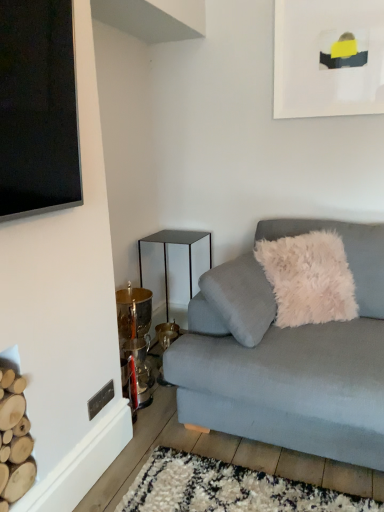
Describe the element at coordinates (166, 251) in the screenshot. I see `metallic/glossy side table at center-left` at that location.

Image resolution: width=384 pixels, height=512 pixels. Describe the element at coordinates (328, 58) in the screenshot. I see `white matte picture frame at upper right` at that location.

I want to click on metallic/glossy side table at center-left, so click(x=166, y=251).

Considering the points (188, 244) and (257, 422), which point is behind, point (188, 244) or point (257, 422)?

The point (188, 244) is farther from the camera.

Between metallic/glossy side table at center-left and light gray fabric couch at lower right, which one has larger size?

With larger size is light gray fabric couch at lower right.

Considering the sizes of objects metallic/glossy side table at center-left and light gray fabric couch at lower right in the image provided, who is wider, metallic/glossy side table at center-left or light gray fabric couch at lower right?

light gray fabric couch at lower right is wider.

Relative to light gray fabric couch at lower right, is metallic/glossy side table at center-left in front or behind?

In the image, metallic/glossy side table at center-left appears behind light gray fabric couch at lower right.

Consider the image. From a real-world perspective, is light gray fabric couch at lower right under metallic/glossy side table at center-left?

No, from a real-world perspective, light gray fabric couch at lower right is not under metallic/glossy side table at center-left.

Is the depth of light gray fabric couch at lower right greater than that of metallic/glossy side table at center-left?

No, light gray fabric couch at lower right is in front of metallic/glossy side table at center-left.

Which point is more distant from viewer, (244, 394) or (159, 241)?

The point (159, 241) is behind.

In terms of width, does light gray fabric couch at lower right look wider or thinner when compared to metallic/glossy side table at center-left?

Clearly, light gray fabric couch at lower right has more width compared to metallic/glossy side table at center-left.

Would you say white matte picture frame at upper right is inside or outside light gray fabric couch at lower right?

white matte picture frame at upper right is located beyond the bounds of light gray fabric couch at lower right.

From a real-world perspective, which is physically below, white matte picture frame at upper right or light gray fabric couch at lower right?

light gray fabric couch at lower right is physically lower.

How many degrees apart are the facing directions of white matte picture frame at upper right and light gray fabric couch at lower right?

0.206 degrees.

Is white matte picture frame at upper right next to light gray fabric couch at lower right?

They are not placed beside each other.

From the image's perspective, is light gray fabric couch at lower right over white matte picture frame at upper right?

No.

Is light gray fabric couch at lower right not within white matte picture frame at upper right?

light gray fabric couch at lower right lies outside white matte picture frame at upper right's area.

Which is behind, point (306, 426) or point (344, 93)?

The point (344, 93) is behind.

Considering the sizes of objects metallic/glossy side table at center-left and white matte picture frame at upper right in the image provided, who is wider, metallic/glossy side table at center-left or white matte picture frame at upper right?

Wider between the two is metallic/glossy side table at center-left.

Is metallic/glossy side table at center-left far away from white matte picture frame at upper right?

metallic/glossy side table at center-left is positioned a significant distance from white matte picture frame at upper right.

Considering the sizes of objects metallic/glossy side table at center-left and white matte picture frame at upper right in the image provided, who is taller, metallic/glossy side table at center-left or white matte picture frame at upper right?

metallic/glossy side table at center-left is taller.

Is metallic/glossy side table at center-left closer to camera compared to white matte picture frame at upper right?

No, the depth of metallic/glossy side table at center-left is greater than that of white matte picture frame at upper right.

Is white matte picture frame at upper right positioned far away from metallic/glossy side table at center-left?

That's right, there is a large distance between white matte picture frame at upper right and metallic/glossy side table at center-left.

From a real-world perspective, is white matte picture frame at upper right located beneath metallic/glossy side table at center-left?

No, from a real-world perspective, white matte picture frame at upper right is not under metallic/glossy side table at center-left.

Is white matte picture frame at upper right outside of metallic/glossy side table at center-left?

Yes, white matte picture frame at upper right is outside of metallic/glossy side table at center-left.

This screenshot has height=512, width=384. I want to click on table that is on the left side of white matte picture frame at upper right, so click(166, 251).

Identify the location of table that is behind the light gray fabric couch at lower right. Image resolution: width=384 pixels, height=512 pixels. (166, 251).

Locate an element on the screen. studio couch in front of the metallic/glossy side table at center-left is located at coordinates (294, 365).

Which object lies nearer to the anchor point light gray fabric couch at lower right, metallic/glossy side table at center-left or white matte picture frame at upper right?

metallic/glossy side table at center-left is positioned closer to the anchor light gray fabric couch at lower right.

Considering their positions, is light gray fabric couch at lower right positioned closer to metallic/glossy side table at center-left than white matte picture frame at upper right?

The object closer to metallic/glossy side table at center-left is light gray fabric couch at lower right.

Based on their spatial positions, is light gray fabric couch at lower right or metallic/glossy side table at center-left further from white matte picture frame at upper right?

Based on the image, metallic/glossy side table at center-left appears to be further to white matte picture frame at upper right.

Considering their positions, is white matte picture frame at upper right positioned closer to metallic/glossy side table at center-left than light gray fabric couch at lower right?

light gray fabric couch at lower right is closer to metallic/glossy side table at center-left.

Estimate the real-world distances between objects in this image. Which object is closer to white matte picture frame at upper right, metallic/glossy side table at center-left or light gray fabric couch at lower right?

Based on the image, light gray fabric couch at lower right appears to be nearer to white matte picture frame at upper right.

Considering their positions, is white matte picture frame at upper right positioned further to light gray fabric couch at lower right than metallic/glossy side table at center-left?

The object further to light gray fabric couch at lower right is white matte picture frame at upper right.

This screenshot has width=384, height=512. I want to click on table between white matte picture frame at upper right and light gray fabric couch at lower right vertically, so click(166, 251).